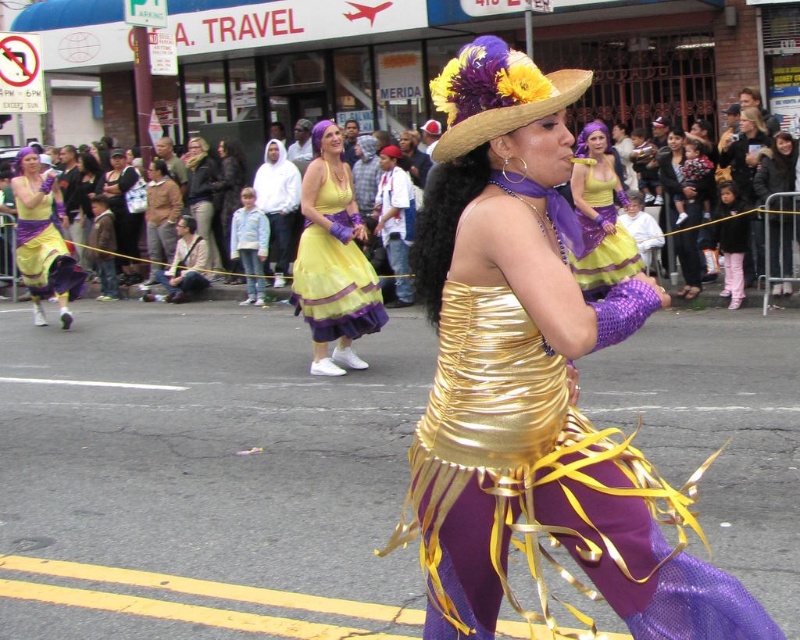
Between point (608, 563) and point (730, 196), which one is positioned behind?

Point (730, 196)

Which is more to the right, metallic gold dress at center or pink fabric pants at right?

pink fabric pants at right is more to the right.

Is point (490, 465) farther from camera compared to point (725, 188)?

No.

You are a GUI agent. You are given a task and a screenshot of the screen. Output one action in this format:
    pyautogui.click(x=<x>, y=<y>)
    Task: Click on the metallic gold dress at center
    This screenshot has width=800, height=640.
    Given the screenshot: What is the action you would take?
    pyautogui.click(x=533, y=380)

Does matte black jacket at upper right lie in front of matte black jacket at center?

Yes.

Can you confirm if matte black jacket at upper right is positioned above matte black jacket at center?

Incorrect, matte black jacket at upper right is not positioned above matte black jacket at center.

Measure the distance between matte black jacket at upper right and camera.

They are 36.50 feet apart.

This screenshot has width=800, height=640. I want to click on matte black jacket at upper right, so click(x=776, y=168).

Who is shorter, straw hat at center or matte black jacket at upper center?

straw hat at center

Which is more to the left, straw hat at center or matte black jacket at upper center?

matte black jacket at upper center is more to the left.

Consider the image. Measure the distance between straw hat at center and camera.

straw hat at center is 8.17 feet from camera.

This screenshot has height=640, width=800. I want to click on straw hat at center, so click(x=496, y=93).